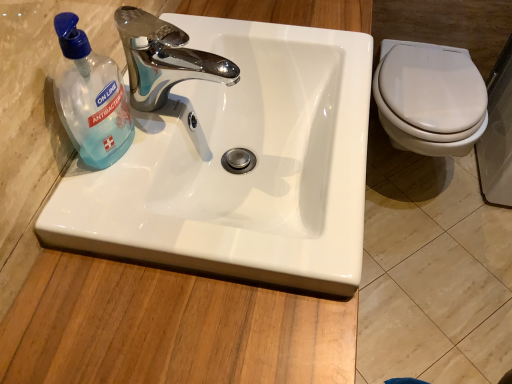
Question: Considering the relative sizes of white glossy sink at center and transparent plastic bottle at left in the image provided, is white glossy sink at center shorter than transparent plastic bottle at left?

Choices:
 (A) no
 (B) yes

Answer: (B)

Question: Does white glossy sink at center touch transparent plastic bottle at left?

Choices:
 (A) no
 (B) yes

Answer: (A)

Question: From a real-world perspective, is white glossy sink at center on top of transparent plastic bottle at left?

Choices:
 (A) yes
 (B) no

Answer: (B)

Question: Could you tell me if white glossy sink at center is turned towards transparent plastic bottle at left?

Choices:
 (A) yes
 (B) no

Answer: (B)

Question: Does white glossy sink at center appear on the left side of transparent plastic bottle at left?

Choices:
 (A) yes
 (B) no

Answer: (B)

Question: Considering the positions of chrome/metallic faucet at upper center and white glossy sink at center in the image, is chrome/metallic faucet at upper center bigger or smaller than white glossy sink at center?

Choices:
 (A) small
 (B) big

Answer: (A)

Question: Is chrome/metallic faucet at upper center wider or thinner than white glossy sink at center?

Choices:
 (A) wide
 (B) thin

Answer: (B)

Question: Considering the positions of point (157, 81) and point (241, 127), is point (157, 81) closer or farther from the camera than point (241, 127)?

Choices:
 (A) closer
 (B) farther

Answer: (A)

Question: Considering their positions, is chrome/metallic faucet at upper center located in front of or behind white glossy sink at center?

Choices:
 (A) front
 (B) behind

Answer: (B)

Question: Is chrome/metallic faucet at upper center inside the boundaries of transparent plastic bottle at left, or outside?

Choices:
 (A) inside
 (B) outside

Answer: (B)

Question: In terms of size, does chrome/metallic faucet at upper center appear bigger or smaller than transparent plastic bottle at left?

Choices:
 (A) big
 (B) small

Answer: (A)

Question: Looking at their shapes, would you say chrome/metallic faucet at upper center is wider or thinner than transparent plastic bottle at left?

Choices:
 (A) wide
 (B) thin

Answer: (A)

Question: From a real-world perspective, is chrome/metallic faucet at upper center above or below transparent plastic bottle at left?

Choices:
 (A) above
 (B) below

Answer: (B)

Question: Is transparent plastic bottle at left bigger or smaller than white glossy sink at center?

Choices:
 (A) small
 (B) big

Answer: (A)

Question: Is transparent plastic bottle at left inside the boundaries of white glossy sink at center, or outside?

Choices:
 (A) inside
 (B) outside

Answer: (B)